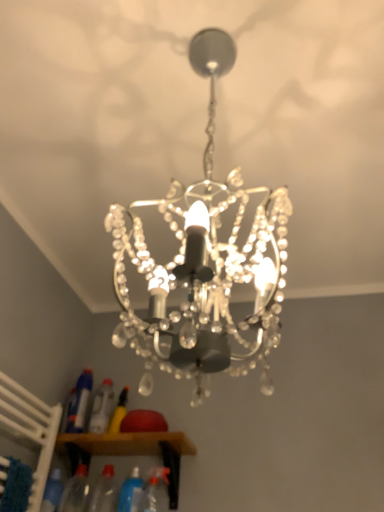
The width and height of the screenshot is (384, 512). Describe the element at coordinates (129, 490) in the screenshot. I see `blue translucent bottle at lower center, the second bottle from the right` at that location.

I want to click on clear plastic bottle at lower left, which is the 3th bottle in left-to-right order, so pyautogui.click(x=101, y=407).

Consider the image. How much space does translucent plastic bottle at lower center, which ranks as the 6th bottle in left-to-right order, occupy vertically?

13.13 inches.

What do you see at coordinates (75, 490) in the screenshot? The height and width of the screenshot is (512, 384). I see `transparent plastic bottle at lower left, the fifth bottle positioned from the right` at bounding box center [75, 490].

You are a GUI agent. You are given a task and a screenshot of the screen. Output one action in this format:
    pyautogui.click(x=<x>, y=<y>)
    Task: Click on the translucent plastic spray bottle at lower left, positioned as the first bottle in left-to-right order
    Image resolution: width=384 pixels, height=512 pixels.
    Given the screenshot: What is the action you would take?
    pyautogui.click(x=79, y=402)

What is the approximate height of wooden cabinet at lower center?

The height of wooden cabinet at lower center is 8.76 inches.

Locate an element on the screen. blue translucent bottle at lower center, the second bottle from the right is located at coordinates (129, 490).

From the image's perspective, does translucent plastic spray bottle at lower left, the 6th bottle in the right-to-left sequence, appear lower than transparent plastic bottle at lower center, the 3th bottle positioned from the right?

No.

In terms of size, does translucent plastic spray bottle at lower left, the 6th bottle in the right-to-left sequence, appear bigger or smaller than transparent plastic bottle at lower center, the fourth bottle from the left?

In the image, translucent plastic spray bottle at lower left, the 6th bottle in the right-to-left sequence, appears to be smaller than transparent plastic bottle at lower center, the fourth bottle from the left.

Considering the positions of point (79, 378) and point (111, 498), is point (79, 378) closer or farther from the camera than point (111, 498)?

Point (79, 378) is farther from the camera than point (111, 498).

Does translucent plastic spray bottle at lower left, the 6th bottle in the right-to-left sequence, appear on the right side of transparent plastic bottle at lower center, the 3th bottle positioned from the right?

Incorrect, translucent plastic spray bottle at lower left, the 6th bottle in the right-to-left sequence, is not on the right side of transparent plastic bottle at lower center, the 3th bottle positioned from the right.

Based on their sizes in the image, would you say blue translucent bottle at lower center, the 5th bottle in the left-to-right sequence, is bigger or smaller than translucent plastic spray bottle at lower left, positioned as the first bottle in left-to-right order?

Clearly, blue translucent bottle at lower center, the 5th bottle in the left-to-right sequence, is larger in size than translucent plastic spray bottle at lower left, positioned as the first bottle in left-to-right order.

Which object is closer to the camera taking this photo, blue translucent bottle at lower center, the second bottle from the right, or translucent plastic spray bottle at lower left, positioned as the first bottle in left-to-right order?

blue translucent bottle at lower center, the second bottle from the right, is more forward.

Which point is more forward, (x=131, y=497) or (x=80, y=392)?

Positioned in front is point (x=131, y=497).

How different are the orientations of blue translucent bottle at lower center, the 5th bottle in the left-to-right sequence, and translucent plastic spray bottle at lower left, the 6th bottle in the right-to-left sequence, in degrees?

10.8 degrees.

Does point (82, 379) come closer to viewer compared to point (122, 501)?

No, it is not.

Does translucent plastic spray bottle at lower left, positioned as the first bottle in left-to-right order, turn towards blue translucent bottle at lower center, the 5th bottle in the left-to-right sequence?

No, translucent plastic spray bottle at lower left, positioned as the first bottle in left-to-right order, does not turn towards blue translucent bottle at lower center, the 5th bottle in the left-to-right sequence.

Is translucent plastic spray bottle at lower left, the 6th bottle in the right-to-left sequence, far away from blue translucent bottle at lower center, the second bottle from the right?

Actually, translucent plastic spray bottle at lower left, the 6th bottle in the right-to-left sequence, and blue translucent bottle at lower center, the second bottle from the right, are a little close together.

Is translucent plastic spray bottle at lower left, positioned as the first bottle in left-to-right order, inside or outside of blue translucent bottle at lower center, the second bottle from the right?

translucent plastic spray bottle at lower left, positioned as the first bottle in left-to-right order, cannot be found inside blue translucent bottle at lower center, the second bottle from the right.

Between clear crystal chandelier at center and clear plastic bottle at lower left, which is the 3th bottle in left-to-right order, which one has smaller size?

clear plastic bottle at lower left, which is the 3th bottle in left-to-right order.

Is clear crystal chandelier at center far away from clear plastic bottle at lower left, which is the 4th bottle from right to left?

Yes, clear crystal chandelier at center is far from clear plastic bottle at lower left, which is the 4th bottle from right to left.

Can you confirm if clear crystal chandelier at center is thinner than clear plastic bottle at lower left, which is the 4th bottle from right to left?

Incorrect, the width of clear crystal chandelier at center is not less than that of clear plastic bottle at lower left, which is the 4th bottle from right to left.

Can you tell me how much blue translucent bottle at lower center, the second bottle from the right, and clear crystal chandelier at center differ in facing direction?

They differ by 151 degrees in their facing directions.

Is blue translucent bottle at lower center, the 5th bottle in the left-to-right sequence, in front of clear crystal chandelier at center?

No, blue translucent bottle at lower center, the 5th bottle in the left-to-right sequence, is behind clear crystal chandelier at center.

In terms of width, does blue translucent bottle at lower center, the 5th bottle in the left-to-right sequence, look wider or thinner when compared to clear crystal chandelier at center?

Considering their sizes, blue translucent bottle at lower center, the 5th bottle in the left-to-right sequence, looks slimmer than clear crystal chandelier at center.

Is point (127, 499) positioned in front of point (158, 302)?

No, (127, 499) is further to viewer.

Between wooden cabinet at lower center and translucent plastic bottle at lower center, which ranks as the 6th bottle in left-to-right order, which one has smaller size?

With smaller size is translucent plastic bottle at lower center, which ranks as the 6th bottle in left-to-right order.

Could you measure the distance between wooden cabinet at lower center and translucent plastic bottle at lower center, which ranks as the 6th bottle in left-to-right order?

The distance of wooden cabinet at lower center from translucent plastic bottle at lower center, which ranks as the 6th bottle in left-to-right order, is 6.52 inches.

Between wooden cabinet at lower center and translucent plastic bottle at lower center, which is the first bottle from right to left, which one appears on the right side from the viewer's perspective?

Positioned to the right is translucent plastic bottle at lower center, which is the first bottle from right to left.

Could you tell me if wooden cabinet at lower center is turned towards translucent plastic bottle at lower center, which is the first bottle from right to left?

No, wooden cabinet at lower center is not turned towards translucent plastic bottle at lower center, which is the first bottle from right to left.

Considering the sizes of objects wooden cabinet at lower center and clear crystal chandelier at center in the image provided, who is thinner, wooden cabinet at lower center or clear crystal chandelier at center?

With smaller width is wooden cabinet at lower center.

Who is taller, wooden cabinet at lower center or clear crystal chandelier at center?

clear crystal chandelier at center is taller.

Measure the distance from wooden cabinet at lower center to clear crystal chandelier at center.

wooden cabinet at lower center and clear crystal chandelier at center are 37.83 inches apart from each other.

I want to click on bottle that is the 5th object located above the transparent plastic bottle at lower center, the 3th bottle positioned from the right (from the image's perspective), so click(79, 402).

The width and height of the screenshot is (384, 512). I want to click on the 4th bottle to the left of the blue translucent bottle at lower center, the second bottle from the right, starting your count from the anchor, so click(79, 402).

From the picture: Based on their spatial positions, is clear plastic bottle at lower left, which is the 4th bottle from right to left, or transparent plastic bottle at lower center, the fourth bottle from the left, closer to translucent plastic bottle at lower center, which ranks as the 6th bottle in left-to-right order?

transparent plastic bottle at lower center, the fourth bottle from the left, is closer to translucent plastic bottle at lower center, which ranks as the 6th bottle in left-to-right order.

From the image, which object appears to be nearer to clear plastic bottle at lower left, which is the 3th bottle in left-to-right order, transparent plastic bottle at lower center, the 3th bottle positioned from the right, or translucent plastic bottle at lower center, which is the first bottle from right to left?

The object closer to clear plastic bottle at lower left, which is the 3th bottle in left-to-right order, is transparent plastic bottle at lower center, the 3th bottle positioned from the right.

Estimate the real-world distances between objects in this image. Which object is closer to translucent plastic spray bottle at lower left, positioned as the first bottle in left-to-right order, transparent plastic bottle at lower center, the 3th bottle positioned from the right, or blue translucent bottle at lower center, the second bottle from the right?

Among the two, transparent plastic bottle at lower center, the 3th bottle positioned from the right, is located nearer to translucent plastic spray bottle at lower left, positioned as the first bottle in left-to-right order.

From the image, which object appears to be farther from transparent plastic bottle at lower left, the fifth bottle positioned from the right, transparent plastic bottle at lower center, the 3th bottle positioned from the right, or blue translucent bottle at lower center, the second bottle from the right?

The object further to transparent plastic bottle at lower left, the fifth bottle positioned from the right, is blue translucent bottle at lower center, the second bottle from the right.

Looking at the image, which one is located further to wooden cabinet at lower center, translucent plastic bottle at lower center, which is the first bottle from right to left, or translucent plastic spray bottle at lower left, the 6th bottle in the right-to-left sequence?

translucent plastic spray bottle at lower left, the 6th bottle in the right-to-left sequence, is positioned further to the anchor wooden cabinet at lower center.

Looking at the image, which one is located further to wooden cabinet at lower center, blue translucent bottle at lower center, the 5th bottle in the left-to-right sequence, or clear plastic bottle at lower left, which is the 4th bottle from right to left?

blue translucent bottle at lower center, the 5th bottle in the left-to-right sequence, is further to wooden cabinet at lower center.

From the image, which object appears to be farther from transparent plastic bottle at lower left, which is the 2th bottle in left-to-right order, transparent plastic bottle at lower center, the fourth bottle from the left, or clear plastic bottle at lower left, which is the 3th bottle in left-to-right order?

The object further to transparent plastic bottle at lower left, which is the 2th bottle in left-to-right order, is clear plastic bottle at lower left, which is the 3th bottle in left-to-right order.

Which object lies nearer to the anchor point translucent plastic spray bottle at lower left, the 6th bottle in the right-to-left sequence, translucent plastic bottle at lower center, which is the first bottle from right to left, or transparent plastic bottle at lower center, the fourth bottle from the left?

Based on the image, transparent plastic bottle at lower center, the fourth bottle from the left, appears to be nearer to translucent plastic spray bottle at lower left, the 6th bottle in the right-to-left sequence.

The image size is (384, 512). I want to click on cabinet positioned between clear crystal chandelier at center and translucent plastic spray bottle at lower left, the 6th bottle in the right-to-left sequence, from near to far, so click(129, 451).

Where is `cabinet between transparent plastic bottle at lower center, the fourth bottle from the left, and translucent plastic bottle at lower center, which is the first bottle from right to left`? The width and height of the screenshot is (384, 512). cabinet between transparent plastic bottle at lower center, the fourth bottle from the left, and translucent plastic bottle at lower center, which is the first bottle from right to left is located at coordinates (129, 451).

Image resolution: width=384 pixels, height=512 pixels. Find the location of `cabinet between clear crystal chandelier at center and transparent plastic bottle at lower left, which is the 2th bottle in left-to-right order, in the up-down direction`. cabinet between clear crystal chandelier at center and transparent plastic bottle at lower left, which is the 2th bottle in left-to-right order, in the up-down direction is located at coordinates (129, 451).

In order to click on cabinet between clear crystal chandelier at center and blue translucent bottle at lower center, the 5th bottle in the left-to-right sequence, vertically in this screenshot , I will do `click(129, 451)`.